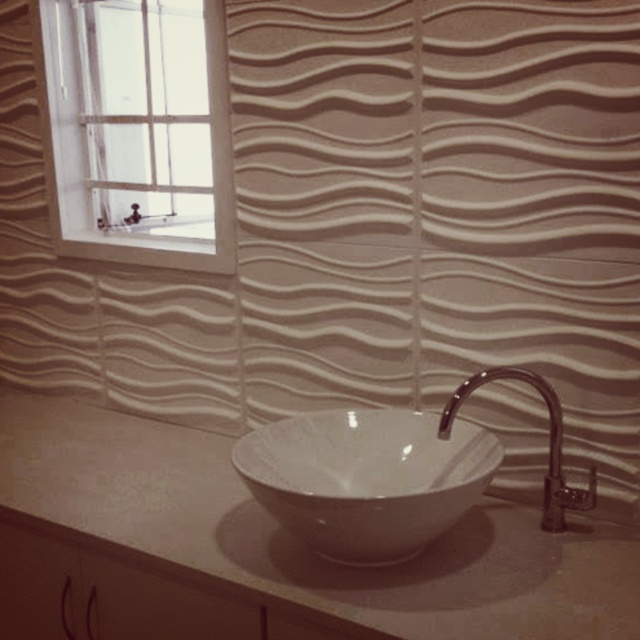
Locate an element on the screen. white glossy countertop at center is located at coordinates (291, 545).

Image resolution: width=640 pixels, height=640 pixels. In order to click on white glossy countertop at center in this screenshot , I will do `click(291, 545)`.

Who is positioned more to the right, white glossy countertop at center or white wooden window at upper left?

Positioned to the right is white glossy countertop at center.

Which of these two, white glossy countertop at center or white wooden window at upper left, stands taller?

white wooden window at upper left is taller.

Between point (406, 586) and point (99, 49), which one is positioned in front?

Point (406, 586) is in front.

Where is `white glossy countertop at center`? This screenshot has height=640, width=640. white glossy countertop at center is located at coordinates (291, 545).

Can you confirm if white wooden window at upper left is thinner than white glossy basin at center?

No, white wooden window at upper left is not thinner than white glossy basin at center.

Does point (97, 195) lie behind point (433, 474)?

Yes, it is.

You are a GUI agent. You are given a task and a screenshot of the screen. Output one action in this format:
    pyautogui.click(x=<x>, y=<y>)
    Task: Click on the white wooden window at upper left
    Image resolution: width=640 pixels, height=640 pixels.
    Given the screenshot: What is the action you would take?
    point(140,131)